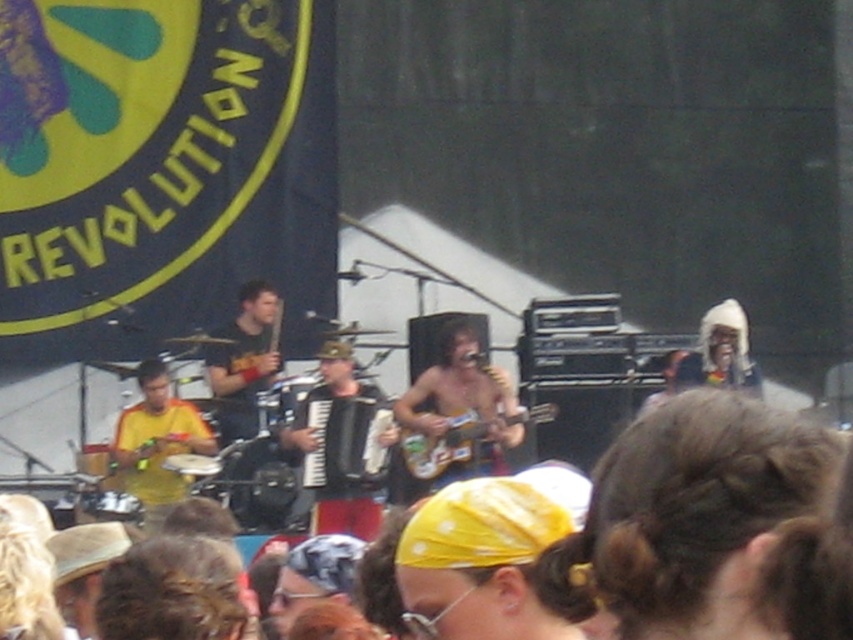
Between yellow matte shirt at left and matte black guitar at center, which one appears on the left side from the viewer's perspective?

Positioned to the left is yellow matte shirt at left.

I want to click on yellow matte shirt at left, so click(x=155, y=444).

Describe the element at coordinates (155, 444) in the screenshot. I see `yellow matte shirt at left` at that location.

Find the location of a particular element. yellow matte shirt at left is located at coordinates (155, 444).

Does point (505, 401) lie in front of point (138, 436)?

No.

Between point (496, 464) and point (207, 442), which one is positioned behind?

Positioned behind is point (496, 464).

Is point (439, 333) farther from viewer compared to point (144, 518)?

Yes, point (439, 333) is farther from viewer.

Locate an element on the screen. The width and height of the screenshot is (853, 640). shiny gold guitar at center is located at coordinates (462, 404).

Which of these two, brown hair at lower left or shiny gold guitar at center, stands taller?

With more height is brown hair at lower left.

How distant is brown hair at lower left from shiny gold guitar at center?

The distance of brown hair at lower left from shiny gold guitar at center is 19.35 meters.

The image size is (853, 640). What do you see at coordinates (173, 592) in the screenshot? I see `brown hair at lower left` at bounding box center [173, 592].

This screenshot has height=640, width=853. Find the location of `brown hair at lower left`. brown hair at lower left is located at coordinates (173, 592).